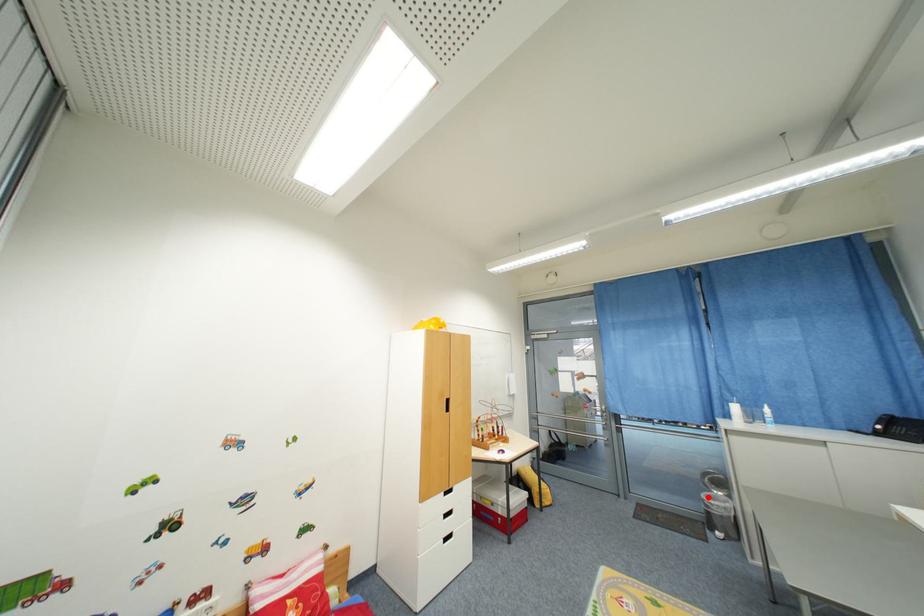
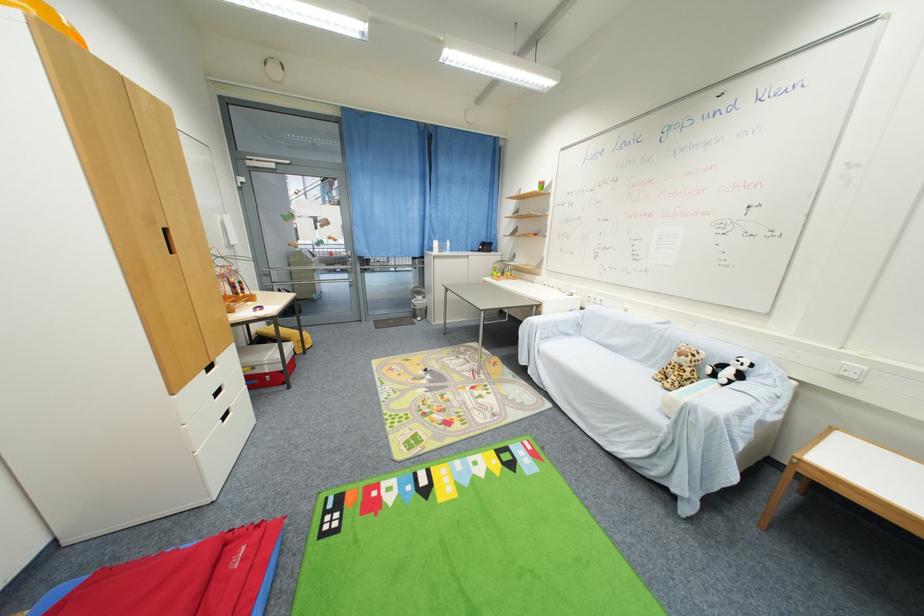
Where in the second image is the point corresponding to the highlighted location from the first image?

(418, 302)